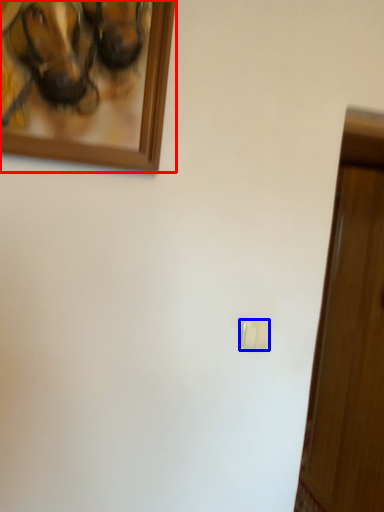
Question: Which of the following is the closest to the observer, picture frame (highlighted by a red box) or light switch (highlighted by a blue box)?

Choices:
 (A) picture frame
 (B) light switch

Answer: (A)